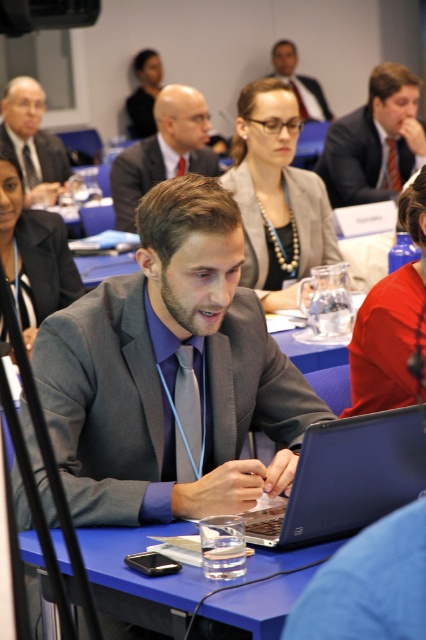
Is the position of matte black hair at upper center more distant than that of gray fabric tie at center?

Yes, matte black hair at upper center is behind gray fabric tie at center.

Can you confirm if matte black hair at upper center is positioned below gray fabric tie at center?

Incorrect, matte black hair at upper center is not positioned below gray fabric tie at center.

At what (x,y) coordinates should I click in order to perform the action: click on matte black hair at upper center. Please return your answer as a coordinate pair (x, y). Looking at the image, I should click on (144, 92).

At what (x,y) coordinates should I click in order to perform the action: click on matte black hair at upper center. Please return your answer as a coordinate pair (x, y). The image size is (426, 640). Looking at the image, I should click on (144, 92).

Between point (313, 500) and point (178, 172), which one is positioned in front?

Point (313, 500) is in front.

Locate an element on the screen. The width and height of the screenshot is (426, 640). matte black laptop at center is located at coordinates (347, 477).

Does point (290, 500) lie in front of point (184, 161)?

Yes, point (290, 500) is closer to viewer.

In order to click on matte black laptop at center in this screenshot , I will do `click(347, 477)`.

Does pearl necklace at center appear over blue plastic table at center?

Correct, pearl necklace at center is located above blue plastic table at center.

Between pearl necklace at center and blue plastic table at center, which one is positioned lower?

blue plastic table at center is below.

Locate an element on the screen. Image resolution: width=426 pixels, height=640 pixels. pearl necklace at center is located at coordinates (276, 195).